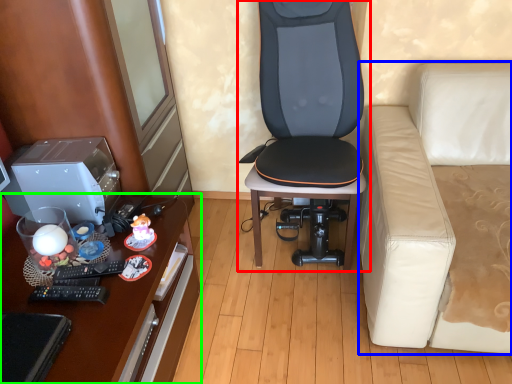
Question: Considering the real-world distances, which object is closest to chair (highlighted by a red box)? studio couch (highlighted by a blue box) or desk (highlighted by a green box).

Choices:
 (A) studio couch
 (B) desk

Answer: (A)